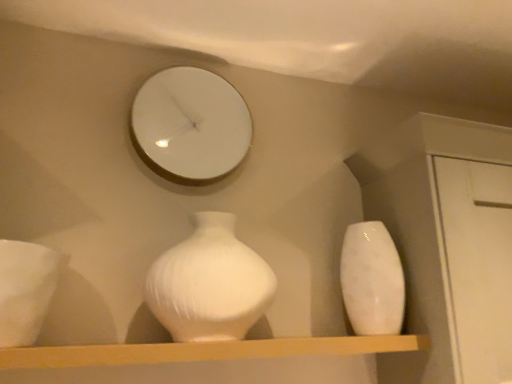
Question: Does white glossy mirror at upper center come behind smooth wooden shelf at center?

Choices:
 (A) yes
 (B) no

Answer: (A)

Question: From a real-world perspective, is white glossy mirror at upper center beneath smooth wooden shelf at center?

Choices:
 (A) yes
 (B) no

Answer: (B)

Question: Can you see white glossy mirror at upper center touching smooth wooden shelf at center?

Choices:
 (A) no
 (B) yes

Answer: (A)

Question: From the image's perspective, would you say white glossy mirror at upper center is positioned over smooth wooden shelf at center?

Choices:
 (A) yes
 (B) no

Answer: (A)

Question: From a real-world perspective, is white glossy mirror at upper center located higher than smooth wooden shelf at center?

Choices:
 (A) yes
 (B) no

Answer: (A)

Question: Does point (168, 299) appear closer or farther from the camera than point (390, 291)?

Choices:
 (A) farther
 (B) closer

Answer: (B)

Question: Considering the positions of white glossy vase at center, arranged as the 1th vase when viewed from the left, and white glossy vase at right, the second vase viewed from the left, in the image, is white glossy vase at center, arranged as the 1th vase when viewed from the left, wider or thinner than white glossy vase at right, the second vase viewed from the left,?

Choices:
 (A) wide
 (B) thin

Answer: (A)

Question: Is white glossy vase at center, marked as the 2th vase in a right-to-left arrangement, taller or shorter than white glossy vase at right, the 1th vase positioned from the right?

Choices:
 (A) tall
 (B) short

Answer: (B)

Question: Would you say white glossy vase at center, arranged as the 1th vase when viewed from the left, is to the left or to the right of white glossy vase at right, the second vase viewed from the left, in the picture?

Choices:
 (A) right
 (B) left

Answer: (B)

Question: In the image, is smooth wooden shelf at center positioned in front of or behind white glossy vase at center, marked as the 2th vase in a right-to-left arrangement?

Choices:
 (A) behind
 (B) front

Answer: (B)

Question: From the image's perspective, relative to white glossy vase at center, arranged as the 1th vase when viewed from the left, is smooth wooden shelf at center above or below?

Choices:
 (A) above
 (B) below

Answer: (B)

Question: Choose the correct answer: Is smooth wooden shelf at center inside white glossy vase at center, arranged as the 1th vase when viewed from the left, or outside it?

Choices:
 (A) outside
 (B) inside

Answer: (A)

Question: From a real-world perspective, is smooth wooden shelf at center positioned above or below white glossy vase at center, marked as the 2th vase in a right-to-left arrangement?

Choices:
 (A) below
 (B) above

Answer: (A)

Question: From a real-world perspective, is white glossy mirror at upper center positioned above or below smooth wooden shelf at center?

Choices:
 (A) above
 (B) below

Answer: (A)

Question: Is white glossy mirror at upper center spatially inside smooth wooden shelf at center, or outside of it?

Choices:
 (A) outside
 (B) inside

Answer: (A)